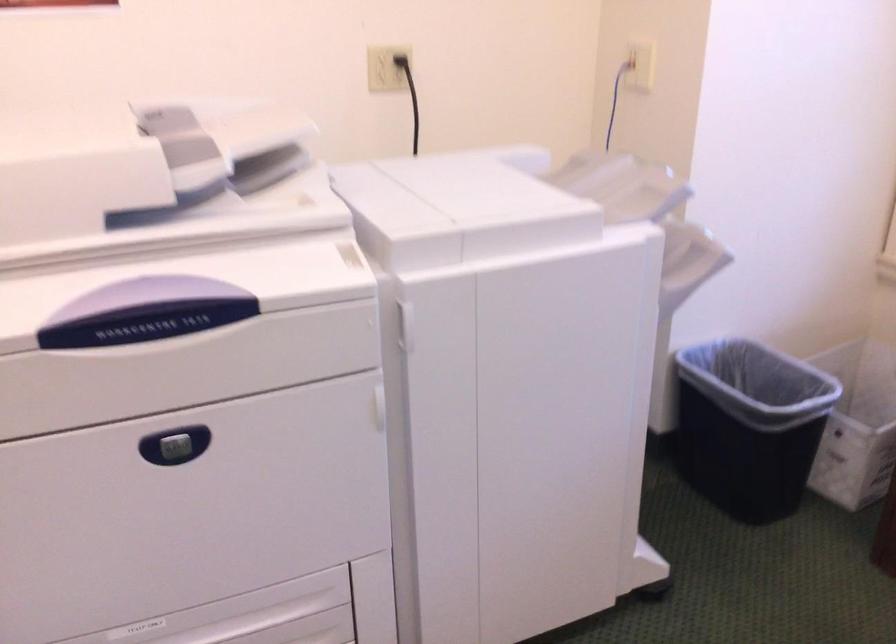
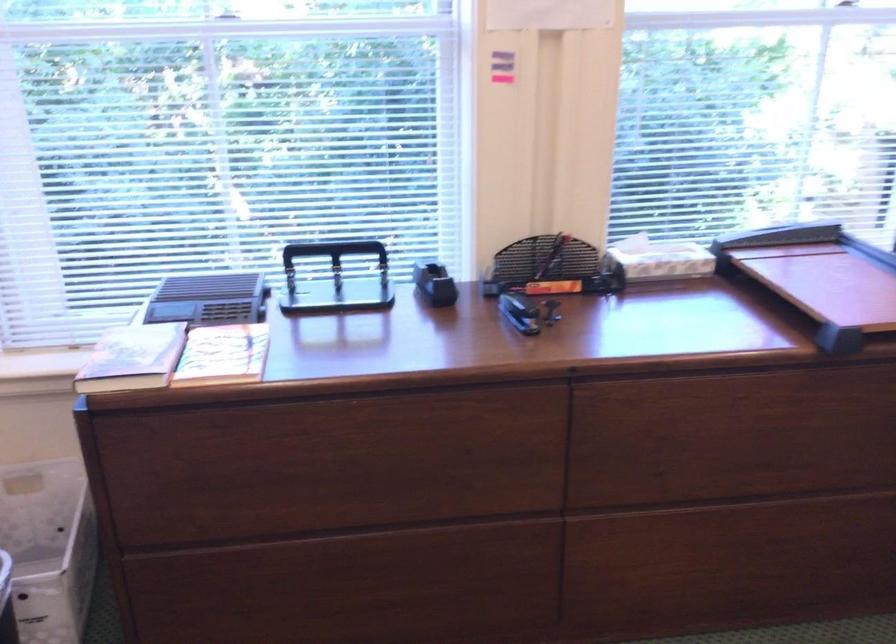
Question: Based on the continuous images, in which direction is the camera rotating? Reply with the corresponding letter.

Choices:
 (A) Left
 (B) Right
 (C) Up
 (D) Down

Answer: (B)